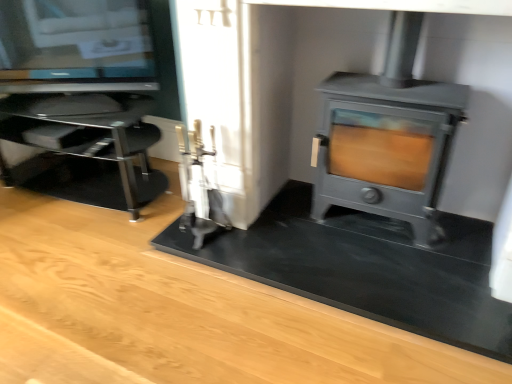
Describe the element at coordinates (388, 137) in the screenshot. I see `matte gray wood burning stove at right` at that location.

Where is `matte gray wood burning stove at right`? This screenshot has width=512, height=384. matte gray wood burning stove at right is located at coordinates (388, 137).

The width and height of the screenshot is (512, 384). I want to click on transparent glass tv stand at left, so click(84, 148).

Describe the element at coordinates (84, 148) in the screenshot. I see `transparent glass tv stand at left` at that location.

Find the location of a particular element. matte gray wood burning stove at right is located at coordinates (388, 137).

Visually, is matte gray wood burning stove at right positioned to the left or to the right of transparent glass tv stand at left?

In the image, matte gray wood burning stove at right appears on the right side of transparent glass tv stand at left.

Is matte gray wood burning stove at right in front of or behind transparent glass tv stand at left in the image?

Clearly, matte gray wood burning stove at right is in front of transparent glass tv stand at left.

Which is farther, (395, 70) or (112, 118)?

The point (112, 118) is more distant.

From the image's perspective, does matte gray wood burning stove at right appear lower than transparent glass tv stand at left?

No, from the image's perspective, matte gray wood burning stove at right is not beneath transparent glass tv stand at left.

From a real-world perspective, between matte gray wood burning stove at right and transparent glass tv stand at left, who is vertically higher?

matte gray wood burning stove at right is physically above.

From the picture: Can you confirm if matte gray wood burning stove at right is wider than transparent glass tv stand at left?

No.

Who is taller, matte gray wood burning stove at right or transparent glass tv stand at left?

With more height is matte gray wood burning stove at right.

Who is bigger, matte gray wood burning stove at right or transparent glass tv stand at left?

transparent glass tv stand at left.

Is matte gray wood burning stove at right located outside transparent glass tv stand at left?

matte gray wood burning stove at right is positioned outside transparent glass tv stand at left.

Is matte gray wood burning stove at right not near transparent glass tv stand at left?

Yes, matte gray wood burning stove at right and transparent glass tv stand at left are located far from each other.

Is matte gray wood burning stove at right facing towards transparent glass tv stand at left?

No, matte gray wood burning stove at right is not turned towards transparent glass tv stand at left.

The image size is (512, 384). Find the location of `wood burning stove located on the right of transparent glass tv stand at left`. wood burning stove located on the right of transparent glass tv stand at left is located at coordinates (388, 137).

Which is more to the left, transparent glass tv stand at left or matte gray wood burning stove at right?

Positioned to the left is transparent glass tv stand at left.

Is transparent glass tv stand at left in front of or behind matte gray wood burning stove at right in the image?

Clearly, transparent glass tv stand at left is behind matte gray wood burning stove at right.

Does point (29, 177) come farther from viewer compared to point (353, 118)?

Yes, point (29, 177) is behind point (353, 118).

From the image's perspective, who appears lower, transparent glass tv stand at left or matte gray wood burning stove at right?

transparent glass tv stand at left is shown below in the image.

From a real-world perspective, is transparent glass tv stand at left over matte gray wood burning stove at right?

Actually, transparent glass tv stand at left is physically below matte gray wood burning stove at right in the real world.

Based on the photo, considering the sizes of transparent glass tv stand at left and matte gray wood burning stove at right in the image, is transparent glass tv stand at left wider or thinner than matte gray wood burning stove at right?

transparent glass tv stand at left is wider than matte gray wood burning stove at right.

Considering the relative sizes of transparent glass tv stand at left and matte gray wood burning stove at right in the image provided, is transparent glass tv stand at left shorter than matte gray wood burning stove at right?

Indeed, transparent glass tv stand at left has a lesser height compared to matte gray wood burning stove at right.

Considering the relative sizes of transparent glass tv stand at left and matte gray wood burning stove at right in the image provided, is transparent glass tv stand at left smaller than matte gray wood burning stove at right?

No.

Is transparent glass tv stand at left outside of matte gray wood burning stove at right?

That's correct, transparent glass tv stand at left is outside of matte gray wood burning stove at right.

Is transparent glass tv stand at left not close to matte gray wood burning stove at right?

Indeed, transparent glass tv stand at left is not near matte gray wood burning stove at right.

Is matte gray wood burning stove at right at the back of transparent glass tv stand at left?

No, transparent glass tv stand at left is not facing away from matte gray wood burning stove at right.

Consider the image. How distant is transparent glass tv stand at left from matte gray wood burning stove at right?

transparent glass tv stand at left is 3.75 feet away from matte gray wood burning stove at right.

Image resolution: width=512 pixels, height=384 pixels. In the image, there is a matte gray wood burning stove at right. What are the coordinates of `furniture below it (from the image's perspective)` in the screenshot? It's located at (84, 148).

The height and width of the screenshot is (384, 512). I want to click on furniture that is below the matte gray wood burning stove at right (from the image's perspective), so click(84, 148).

I want to click on wood burning stove lying above the transparent glass tv stand at left (from the image's perspective), so click(x=388, y=137).